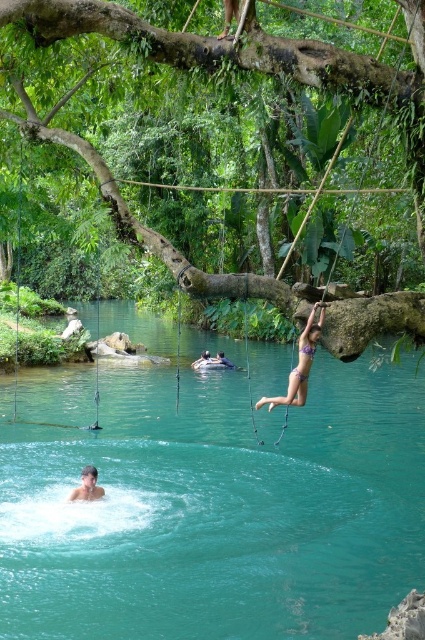
You are a photographer trying to capture the perfect shot of the teal glossy water at center and the purple bikini at center. Which object should you zoom in on to ensure it takes up more space in your photo?

The teal glossy water at center has a larger size compared to the purple bikini at center, so you should zoom in on the teal glossy water at center to ensure it takes up more space in your photo.

You are a swimmer who wants to jump into the water from the branch. Looking at the scene, which object is bigger in size between the teal glossy water at center and the light blue fabric at center?

The teal glossy water at center has a larger size compared to the light blue fabric at center, so the teal glossy water at center is bigger in size.